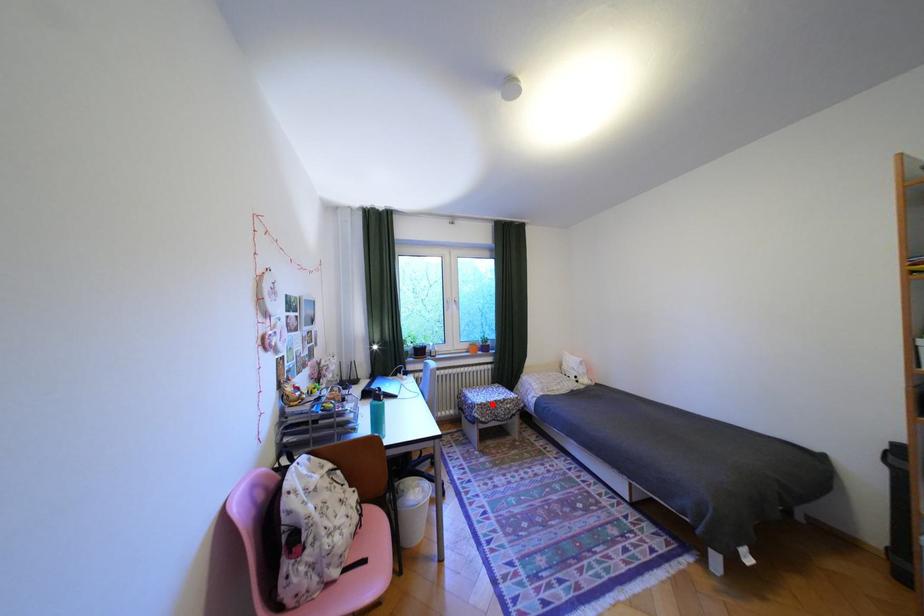
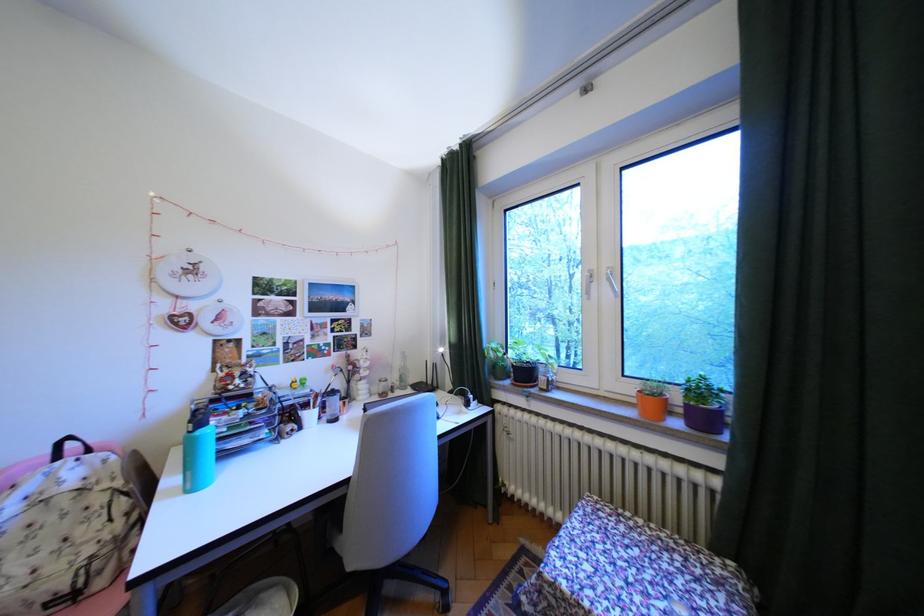
Find the pixel in the second image that matches the highlighted location in the first image.

(564, 585)